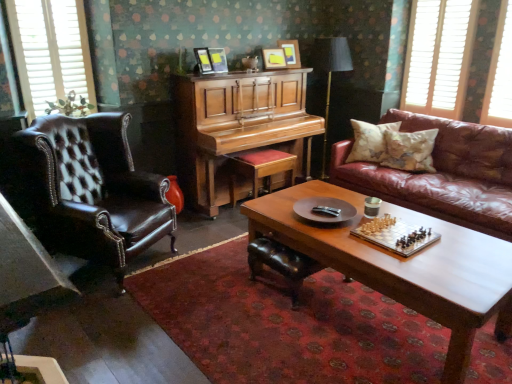
At what (x,y) coordinates should I click in order to perform the action: click on vacant area that is in front of metallic chess set at center. Please return your answer as a coordinate pair (x, y). The height and width of the screenshot is (384, 512). Looking at the image, I should click on (426, 269).